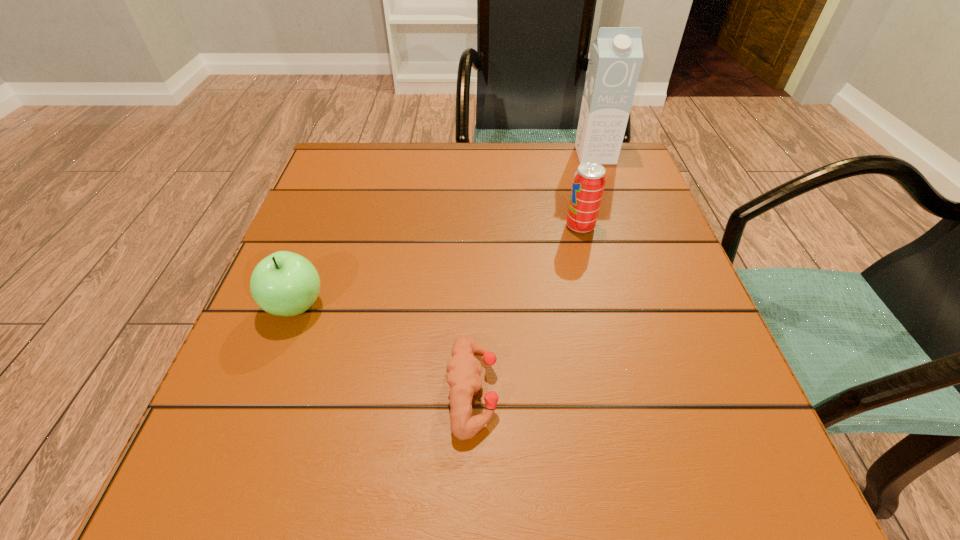
Locate an element on the screen. This screenshot has width=960, height=540. vacant space that is in between the rightmost object and the leftmost object is located at coordinates (445, 231).

At what (x,y) coordinates should I click in order to perform the action: click on vacant space in between the second tallest object and the second nearest object. Please return your answer as a coordinate pair (x, y). Looking at the image, I should click on (438, 266).

The width and height of the screenshot is (960, 540). Identify the location of free spot between the rightmost object and the third farthest object. (445, 231).

Find the location of a particular element. The width and height of the screenshot is (960, 540). the third closest object to the second tallest object is located at coordinates (284, 283).

What are the coordinates of `object that is the second closest to the soda can` in the screenshot? It's located at (463, 370).

What are the coordinates of `vacant area in the image that satisfies the following two spatial constraints: 1. on the front side of the second object from right to left; 2. with the gloves of the nearest object facing forward` in the screenshot? It's located at (621, 391).

The image size is (960, 540). What are the coordinates of `free spot that satisfies the following two spatial constraints: 1. on the front label of the farthest object; 2. with the gloves of the second object from left to right facing forward` in the screenshot? It's located at (677, 391).